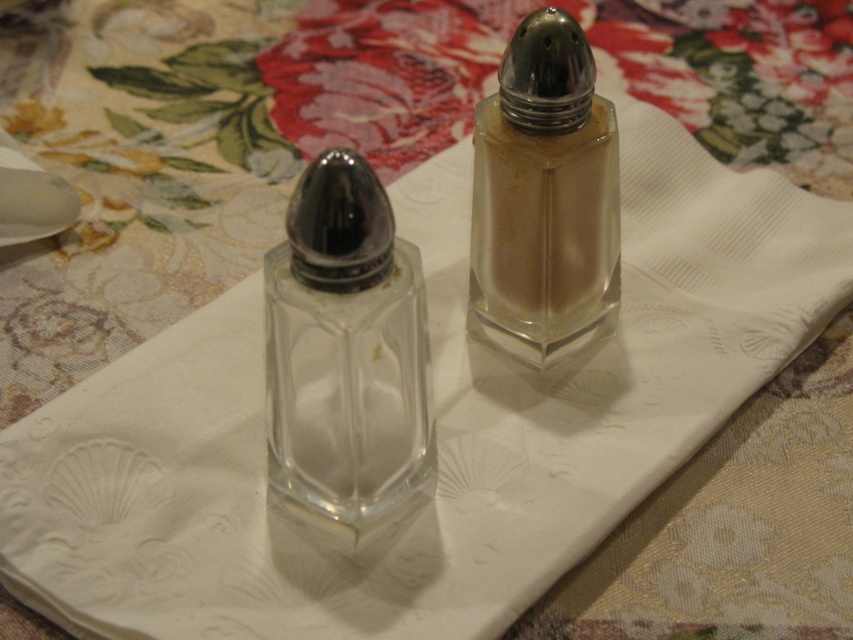
Question: Which point is farther to the camera?

Choices:
 (A) transparent glass salt shaker at center
 (B) clear glass salt shaker at center

Answer: (B)

Question: Is transparent glass salt shaker at center to the left of clear glass salt shaker at center from the viewer's perspective?

Choices:
 (A) no
 (B) yes

Answer: (B)

Question: Is transparent glass salt shaker at center below clear glass salt shaker at center?

Choices:
 (A) yes
 (B) no

Answer: (A)

Question: Can you confirm if transparent glass salt shaker at center is wider than clear glass salt shaker at center?

Choices:
 (A) yes
 (B) no

Answer: (B)

Question: Which point is closer to the camera?

Choices:
 (A) clear glass salt shaker at center
 (B) transparent glass salt shaker at center

Answer: (B)